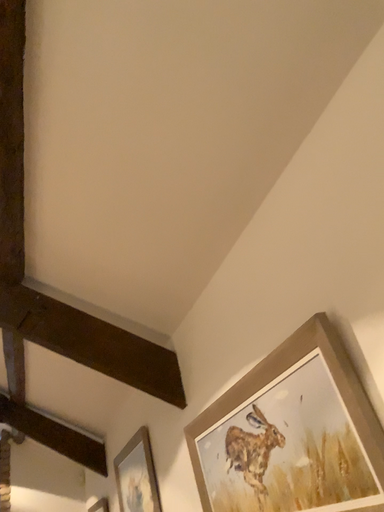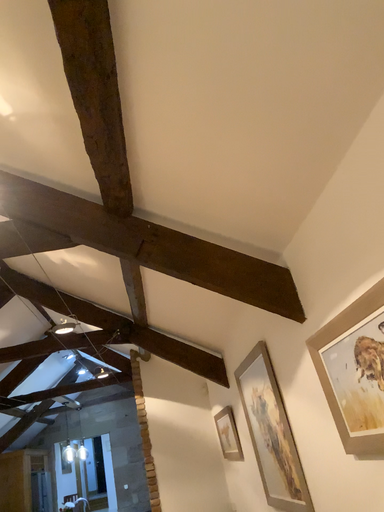
Question: How did the camera likely rotate when shooting the video?

Choices:
 (A) rotated upward
 (B) rotated downward

Answer: (B)